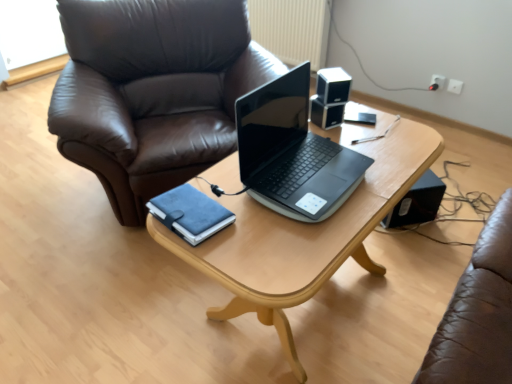
The width and height of the screenshot is (512, 384). I want to click on vacant space to the right of suede blue notebook at center, so click(x=251, y=221).